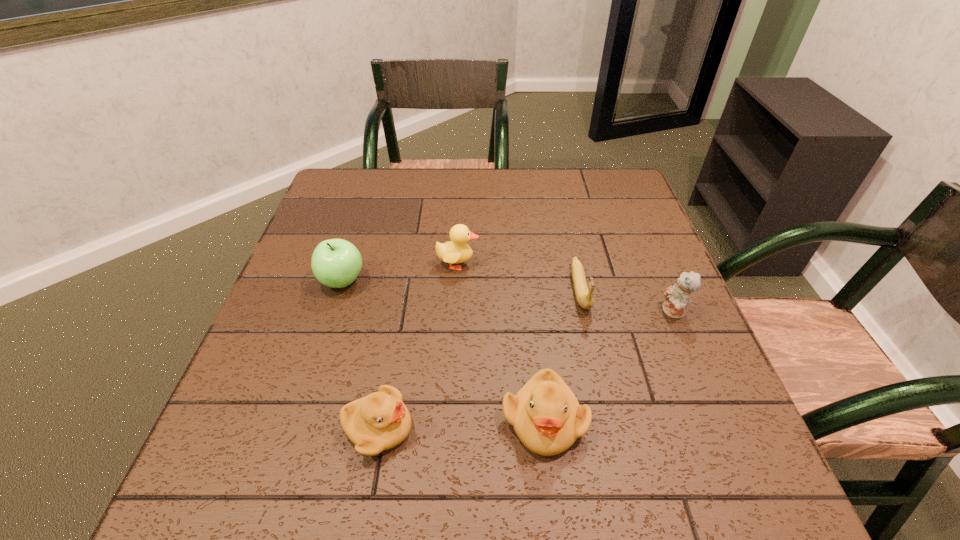
The image size is (960, 540). Find the location of `vacant position in the image that satisfies the following two spatial constraints: 1. on the front-facing side of the teddy bear; 2. on the front-facing side of the third object from right to left`. vacant position in the image that satisfies the following two spatial constraints: 1. on the front-facing side of the teddy bear; 2. on the front-facing side of the third object from right to left is located at coordinates (719, 420).

Where is `free space in the image that satisfies the following two spatial constraints: 1. on the front-facing side of the rightmost duckling; 2. on the front-facing side of the shortest duckling`? This screenshot has height=540, width=960. free space in the image that satisfies the following two spatial constraints: 1. on the front-facing side of the rightmost duckling; 2. on the front-facing side of the shortest duckling is located at coordinates (545, 428).